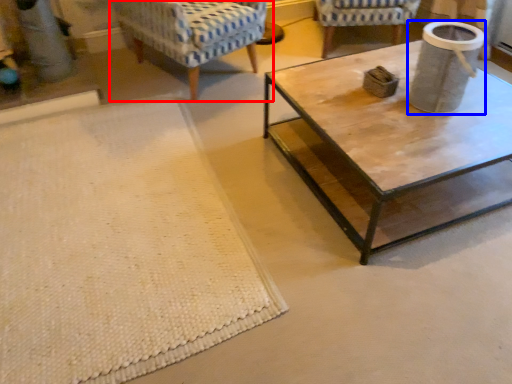
Question: Which point is further to the camera, chair (highlighted by a red box) or gray (highlighted by a blue box)?

Choices:
 (A) chair
 (B) gray

Answer: (A)